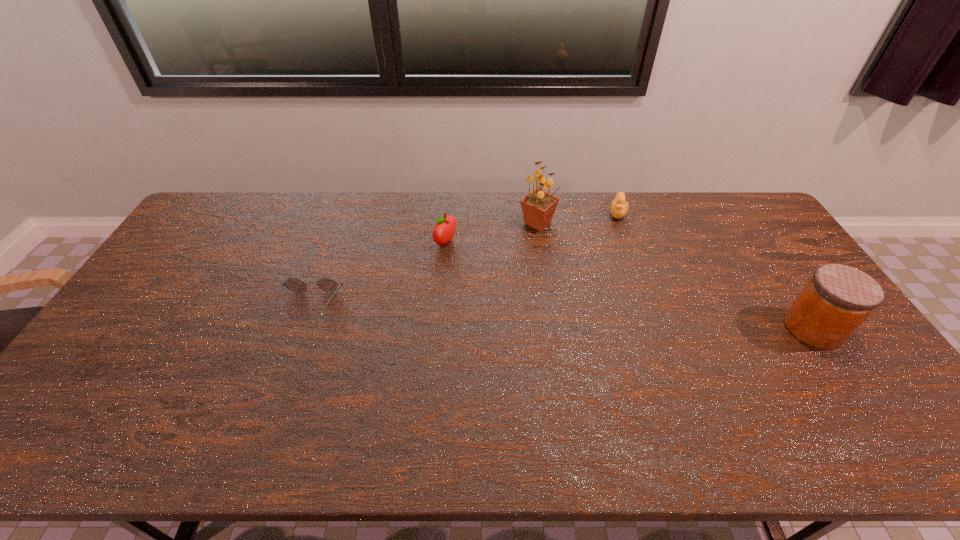
The width and height of the screenshot is (960, 540). Identify the location of free space between the fourth tallest object and the jar. (715, 271).

Find the location of a particular element. The width and height of the screenshot is (960, 540). unoccupied position between the rightmost object and the fourth tallest object is located at coordinates [x=715, y=271].

The height and width of the screenshot is (540, 960). In order to click on vacant area between the fourth shortest object and the shortest object in this screenshot , I will do click(x=562, y=318).

Find the location of a particular element. vacant space that is in between the second tallest object and the tallest object is located at coordinates (675, 275).

The image size is (960, 540). In order to click on free space between the leftmost object and the sunflower in this screenshot , I will do `click(424, 265)`.

In order to click on empty space between the shortest object and the tallest object in this screenshot , I will do `click(424, 265)`.

Identify the location of empty location between the fourth object from left to right and the rightmost object. (715, 271).

Identify the location of free space between the sunflower and the leftmost object. The width and height of the screenshot is (960, 540). (x=424, y=265).

Where is `free area in between the fourth object from right to left and the tallest object`? free area in between the fourth object from right to left and the tallest object is located at coordinates (492, 233).

Identify the location of object that is the closest to the third tallest object. (538, 207).